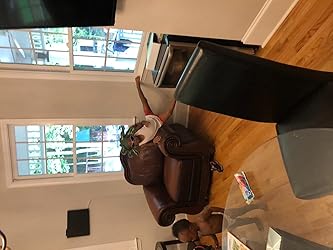
Find the location of a particular element. The width and height of the screenshot is (333, 250). wooden floor is located at coordinates (234, 138).